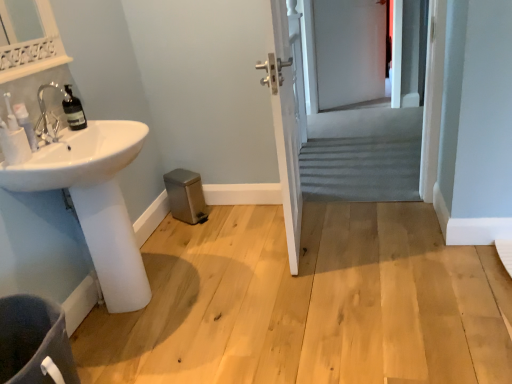
The image size is (512, 384). Find the location of `vacant space in front of translucent glass bottle at left`. vacant space in front of translucent glass bottle at left is located at coordinates (61, 132).